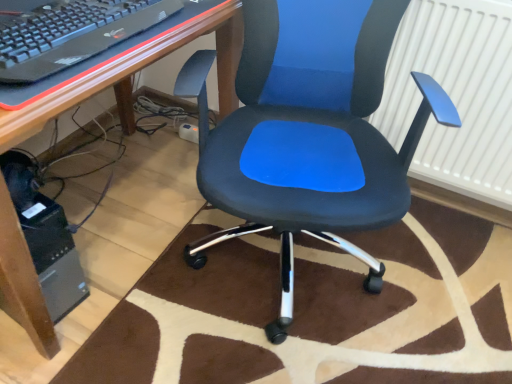
Question: Is the position of black plastic keyboard at upper left less distant than that of black plastic computer tower at lower left?

Choices:
 (A) no
 (B) yes

Answer: (B)

Question: From a real-world perspective, is black plastic keyboard at upper left on black plastic computer tower at lower left?

Choices:
 (A) no
 (B) yes

Answer: (B)

Question: From a real-world perspective, is black plastic keyboard at upper left under black plastic computer tower at lower left?

Choices:
 (A) yes
 (B) no

Answer: (B)

Question: Can you see black plastic keyboard at upper left touching black plastic computer tower at lower left?

Choices:
 (A) no
 (B) yes

Answer: (A)

Question: From the image's perspective, is black plastic keyboard at upper left under black plastic computer tower at lower left?

Choices:
 (A) no
 (B) yes

Answer: (A)

Question: Is the depth of black plastic keyboard at upper left greater than that of black plastic computer tower at lower left?

Choices:
 (A) yes
 (B) no

Answer: (B)

Question: Is white textured radiator at upper right outside brown plush rug at center?

Choices:
 (A) no
 (B) yes

Answer: (B)

Question: Does white textured radiator at upper right contain brown plush rug at center?

Choices:
 (A) no
 (B) yes

Answer: (A)

Question: From a real-world perspective, does white textured radiator at upper right stand above brown plush rug at center?

Choices:
 (A) no
 (B) yes

Answer: (B)

Question: Is white textured radiator at upper right aimed at brown plush rug at center?

Choices:
 (A) yes
 (B) no

Answer: (A)

Question: Considering the relative sizes of white textured radiator at upper right and brown plush rug at center in the image provided, is white textured radiator at upper right taller than brown plush rug at center?

Choices:
 (A) yes
 (B) no

Answer: (A)

Question: Is white textured radiator at upper right shorter than brown plush rug at center?

Choices:
 (A) yes
 (B) no

Answer: (B)

Question: From the image's perspective, is white textured radiator at upper right on top of black plastic keyboard at upper left?

Choices:
 (A) no
 (B) yes

Answer: (A)